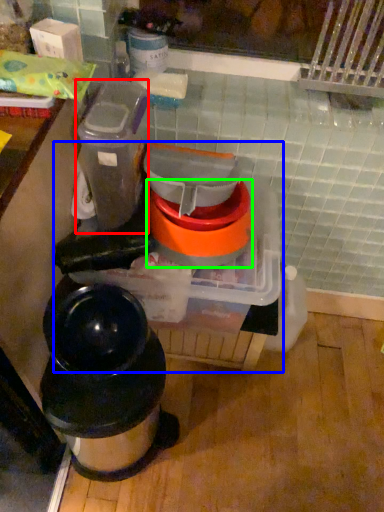
Question: Which is nearer to the appliance (highlighted by a red box)? appliance (highlighted by a blue box) or appliance (highlighted by a green box).

Choices:
 (A) appliance
 (B) appliance

Answer: (B)